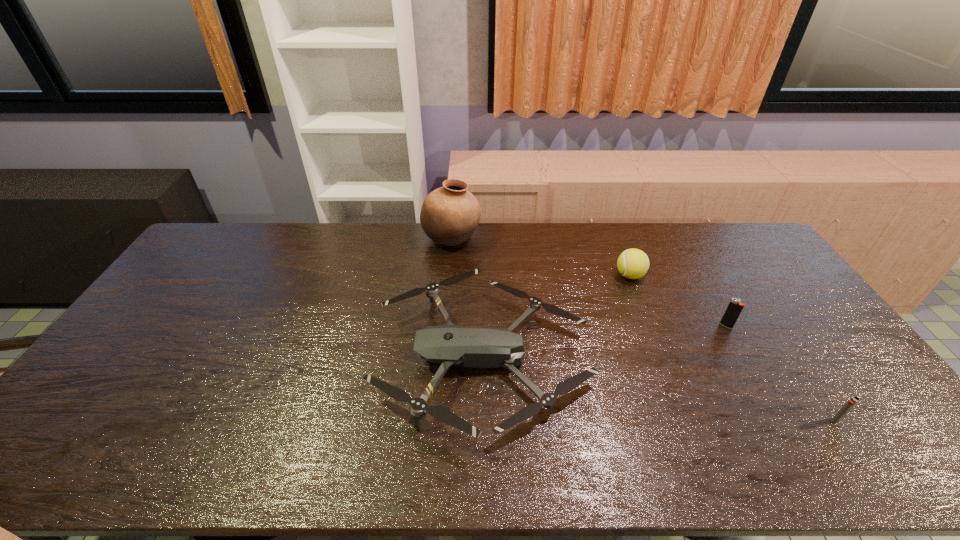
I want to click on free space at the near edge of the desktop, so pyautogui.click(x=825, y=442).

Locate an element on the screen. The width and height of the screenshot is (960, 540). blank space at the left edge is located at coordinates (199, 306).

At what (x,y) coordinates should I click in order to perform the action: click on free space at the right edge of the desktop. Please return your answer as a coordinate pair (x, y). The width and height of the screenshot is (960, 540). Looking at the image, I should click on (777, 294).

At what (x,y) coordinates should I click in order to perform the action: click on free location at the far left corner of the desktop. Please return your answer as a coordinate pair (x, y). The width and height of the screenshot is (960, 540). Looking at the image, I should click on (232, 260).

Locate an element on the screen. Image resolution: width=960 pixels, height=540 pixels. vacant space at the far right corner of the desktop is located at coordinates (735, 255).

Locate an element on the screen. vacant space that is in between the farthest object and the shorter igniter is located at coordinates (644, 329).

The image size is (960, 540). I want to click on vacant area that lies between the nearer igniter and the second farthest object, so pos(732,348).

Where is `empty location between the third object from right to left and the nearer igniter`? The image size is (960, 540). empty location between the third object from right to left and the nearer igniter is located at coordinates (732, 348).

What are the coordinates of `vacant space that's between the fourth nearest object and the farthest object` in the screenshot? It's located at (540, 257).

Locate an element on the screen. The width and height of the screenshot is (960, 540). free spot between the tallest object and the drone is located at coordinates (468, 298).